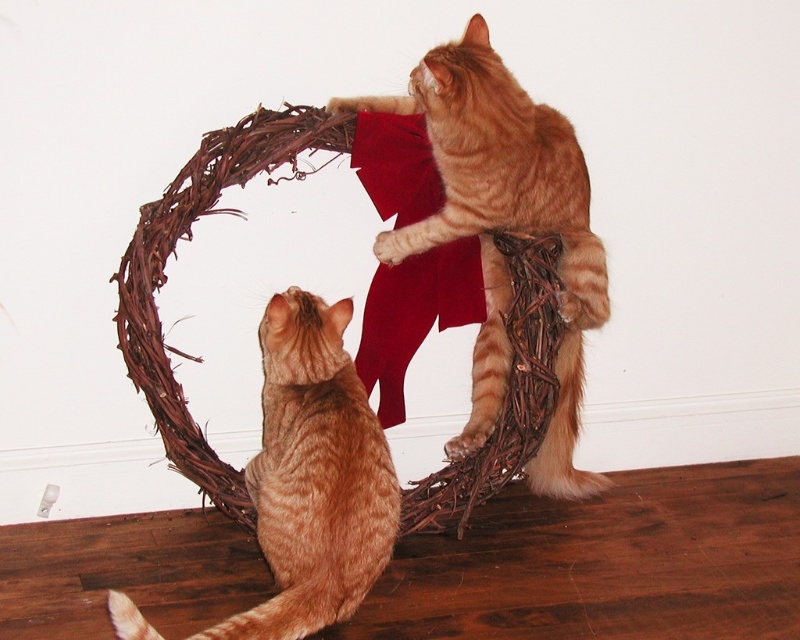
You are a photographer trying to capture a photo of both cats. Since the orange fur cat at upper center is above the orange tabby cat at center, where should you position your camera to ensure both are in frame?

Position the camera so that it can capture both the orange fur cat at upper center and the orange tabby cat at center, with the orange fur cat above the orange tabty cat.

You are a cat owner who wants to ensure both cats have enough space to sit comfortably. Given that the orange fur cat at upper center is wider than the orange tabby cat at center, which cat requires a larger space to sit?

The orange fur cat at upper center requires a larger space to sit because its width surpasses that of the orange tabby cat at center.

You are a cat owner who wants to place a small toy between the orange fur cat at upper center and the orange tabby cat at center. Given that the toy requires 30 centimeters of space to be placed safely, can you fit it between them?

The distance between the orange fur cat at upper center and the orange tabby cat at center is 32.33 centimeters, which is more than the required 30 centimeters. Therefore, the toy can be safely placed between them.